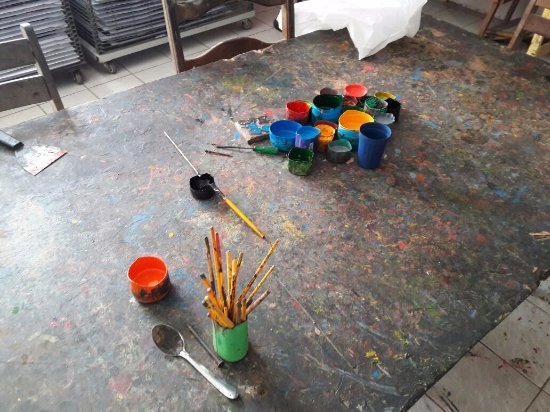
Find the location of a particular element. This screenshot has width=550, height=412. handle of the paintbrush is located at coordinates (109, 263), (242, 217).